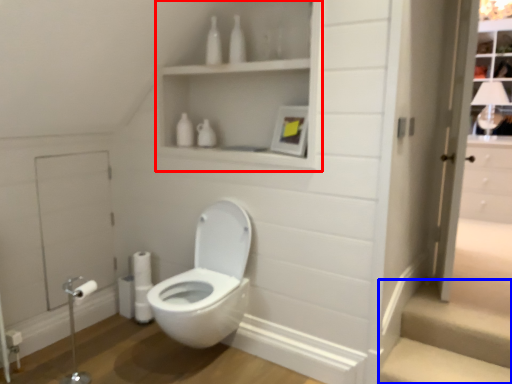
Question: Which point is closer to the camera, medicine cabinet (highlighted by a red box) or stairwell (highlighted by a blue box)?

Choices:
 (A) medicine cabinet
 (B) stairwell

Answer: (A)